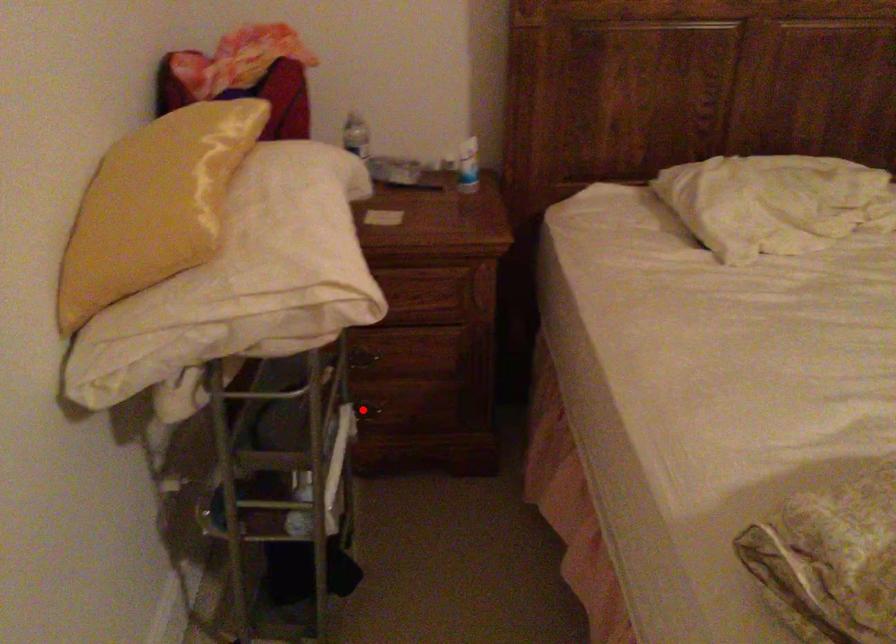
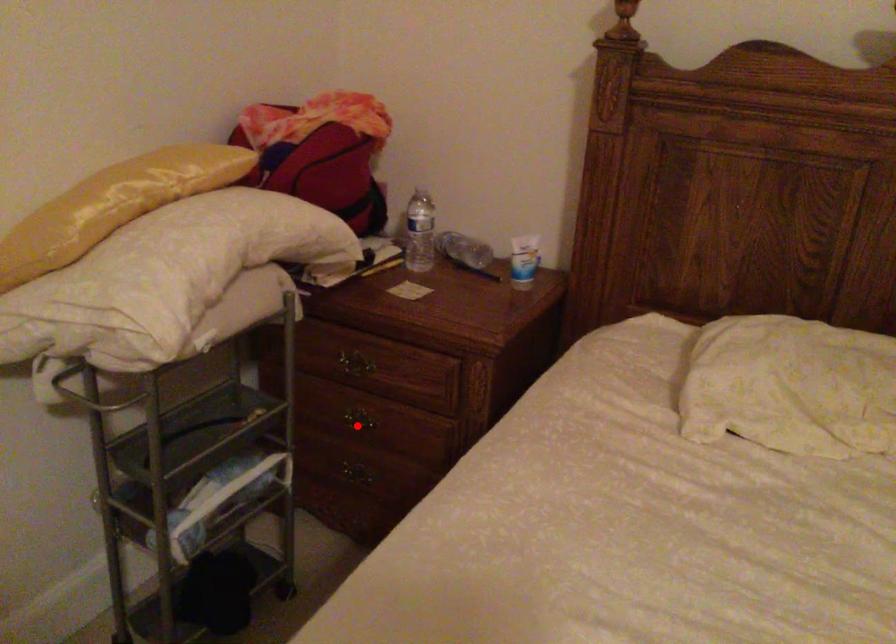
I am providing you with two images of the same scene from different viewpoints. A red point is marked on the first image and another point is marked on the second image. Does the point marked in image1 correspond to the same location as the one in image2?

No